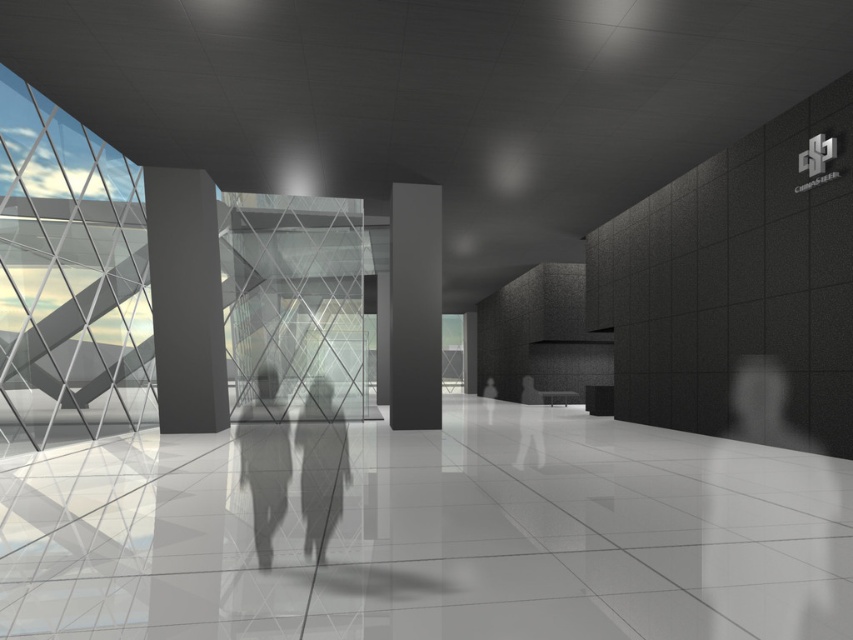
You are standing in the lobby and want to take a photo of the matte gray column at center. If your camera has a maximum focus range of 10 meters, will it be able to capture the column clearly from your current position?

The matte gray column at center and camera are 10.63 meters apart, which exceeds the camera maximum focus range of 10 meters. Therefore, the camera cannot capture the column clearly from your current position.

You are a visitor entering the lobby and want to pass through the area between the matte gray column at center and the silhouette figure at center. Can you walk through the space between them without touching either?

The matte gray column at center has a lesser width compared to the silhouette figure at center. Since the column is narrower than the figure, there is sufficient space between them for you to walk through without touching either.